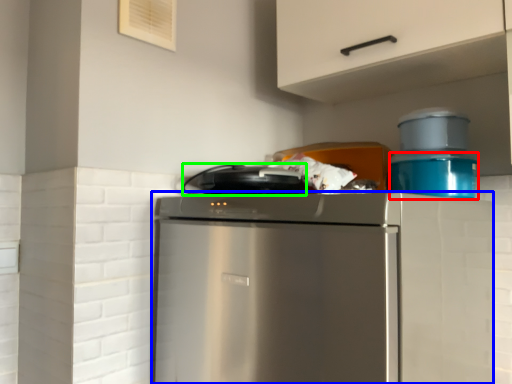
Question: Considering the real-world distances, which object is farthest from appliance (highlighted by a red box)? home appliance (highlighted by a blue box) or appliance (highlighted by a green box)?

Choices:
 (A) home appliance
 (B) appliance

Answer: (A)